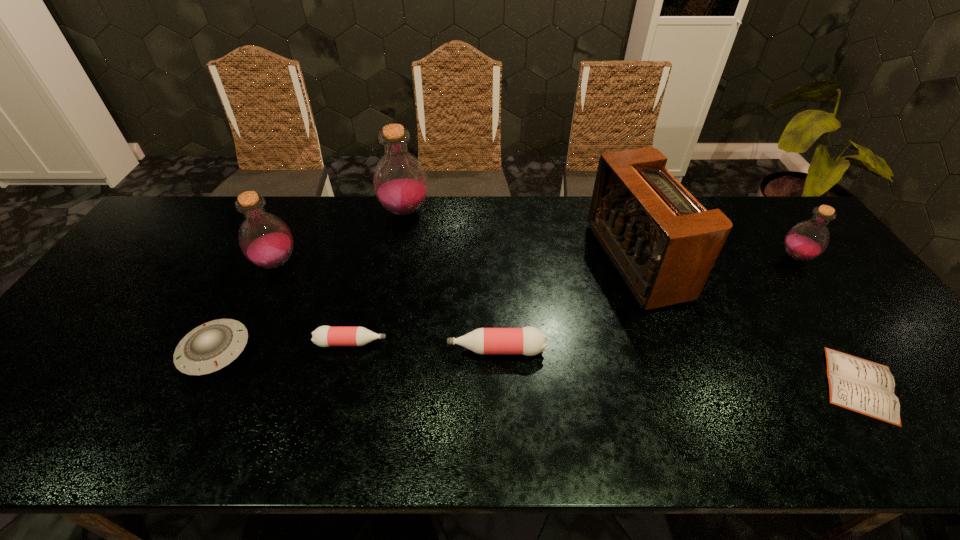
You are a GUI agent. You are given a task and a screenshot of the screen. Output one action in this format:
    pyautogui.click(x=<x>, y=<y>)
    Task: Click on the free space between the saucer and the leftmost purple bottle
    
    Given the screenshot: What is the action you would take?
    pyautogui.click(x=246, y=307)

This screenshot has width=960, height=540. What are the coordinates of `free space between the right pink bottle and the shortest object` in the screenshot? It's located at (678, 367).

At what (x,y) coordinates should I click in order to perform the action: click on empty location between the saucer and the biggest purple bottle. Please return your answer as a coordinate pair (x, y). This screenshot has width=960, height=540. Looking at the image, I should click on (310, 281).

Locate an element on the screen. This screenshot has height=540, width=960. vacant point located between the saucer and the shortest object is located at coordinates (538, 368).

Locate an element on the screen. The width and height of the screenshot is (960, 540). vacant space that's between the third object from right to left and the smaller pink bottle is located at coordinates (494, 302).

Locate an element on the screen. This screenshot has height=540, width=960. object that is the fifth closest to the saucer is located at coordinates (663, 242).

Identify which object is the seventh nearest to the farthest purple bottle. Please provide its 2D coordinates. Your answer should be formatted as a tuple, i.e. [(x, y)], where the tuple contains the x and y coordinates of a point satisfying the conditions above.

[(808, 239)]

Identify the location of bottle that can be found as the fourth closest to the farthest purple bottle. The image size is (960, 540). (808, 239).

Identify the location of bottle that is the fourth closest to the third object from right to left. This screenshot has height=540, width=960. (324, 336).

Locate which purple bottle ranks in proximity to the radio receiver. Please provide its 2D coordinates. Your answer should be formatted as a tuple, i.e. [(x, y)], where the tuple contains the x and y coordinates of a point satisfying the conditions above.

[(808, 239)]